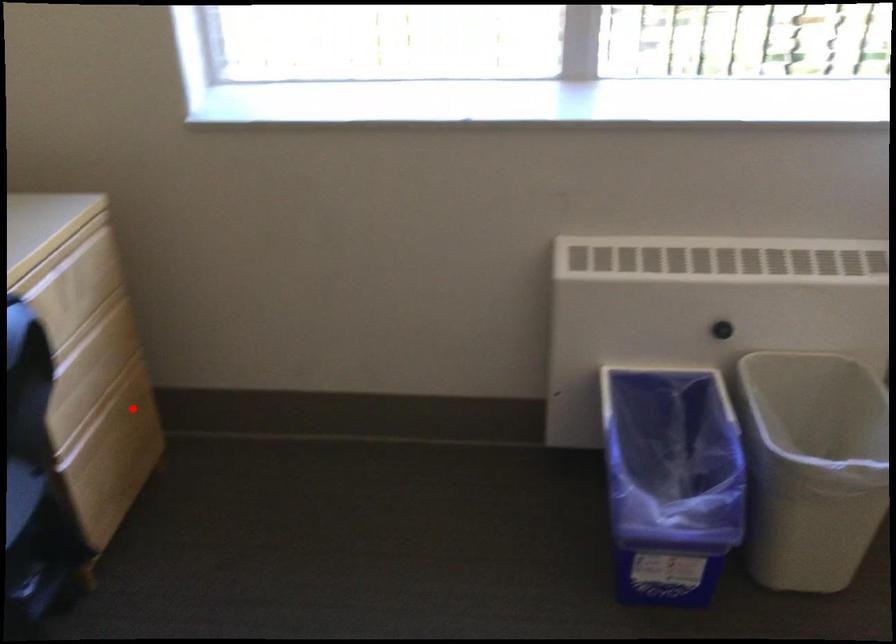
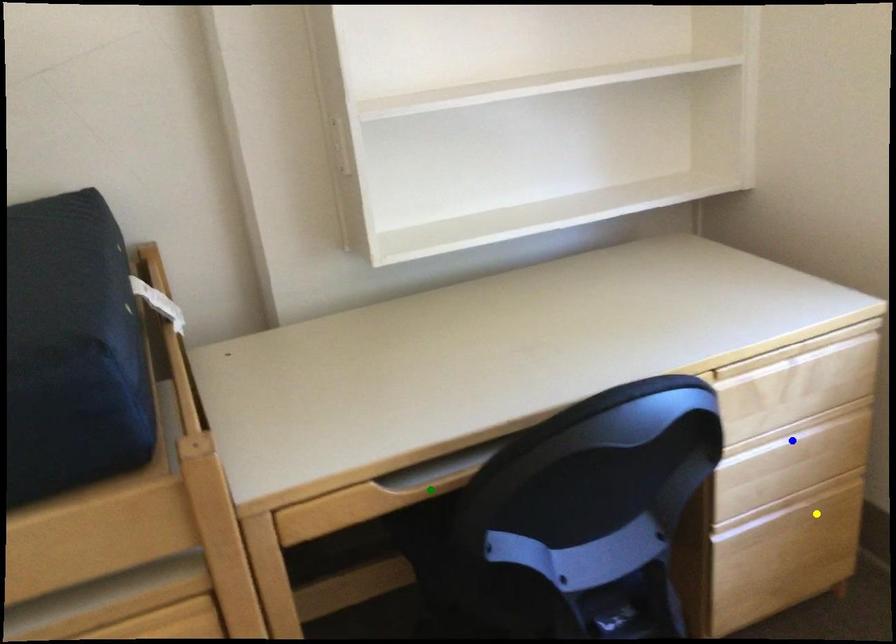
Question: I am providing you with two images of the same scene from different viewpoints. A red point is marked on the first image. You are given multiple points on the second image. Which point in image 2 represents the same 3d spot as the red point in image 1?

Choices:
 (A) blue point
 (B) yellow point
 (C) green point

Answer: (B)